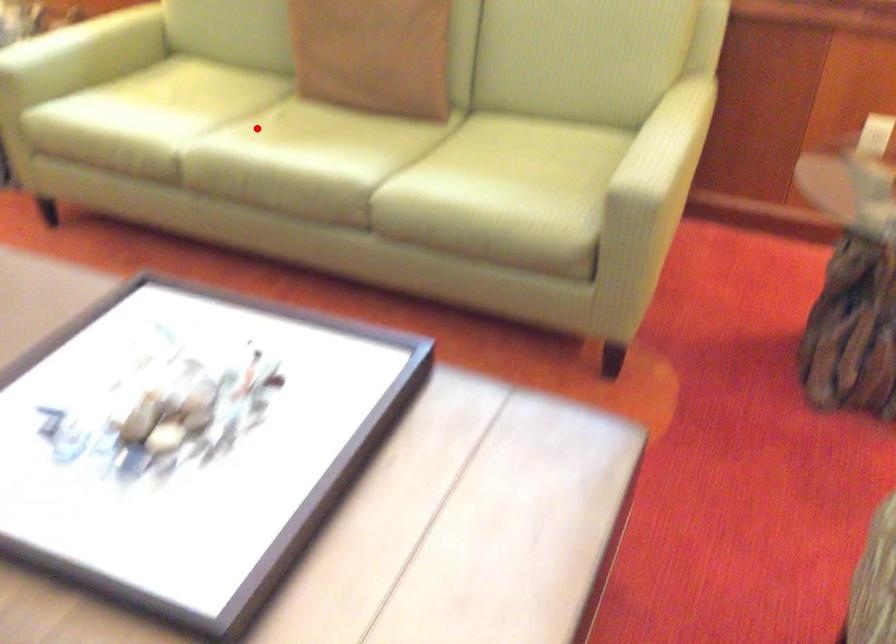
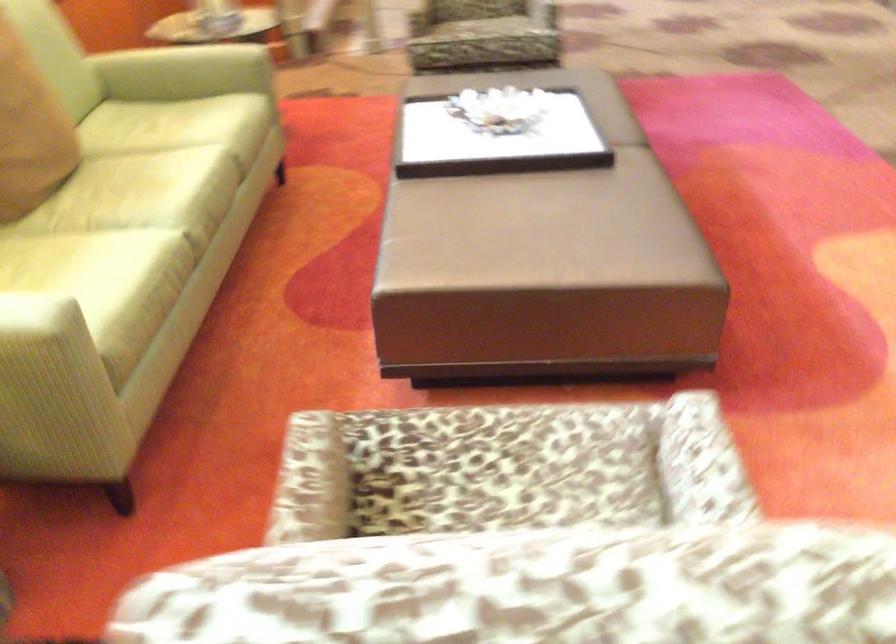
The point at the highlighted location is marked in the first image. Where is the corresponding point in the second image?

(136, 199)